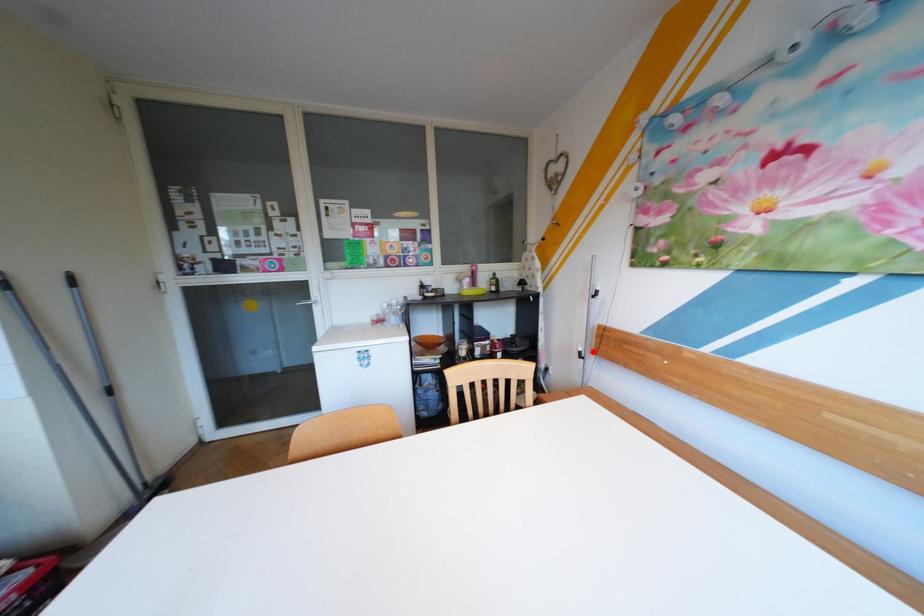
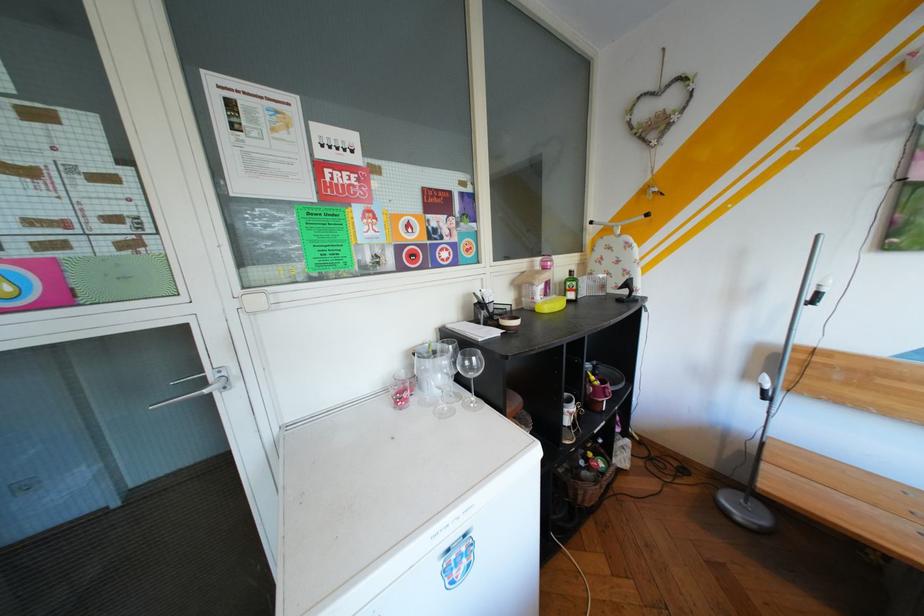
Question: I am providing you with two images of the same scene from different viewpoints. Image1 has a red point marked. In image2, the corresponding 3D location appears at what relative position? Reply with the corresponding letter.

Choices:
 (A) Closer
 (B) Farther

Answer: (A)